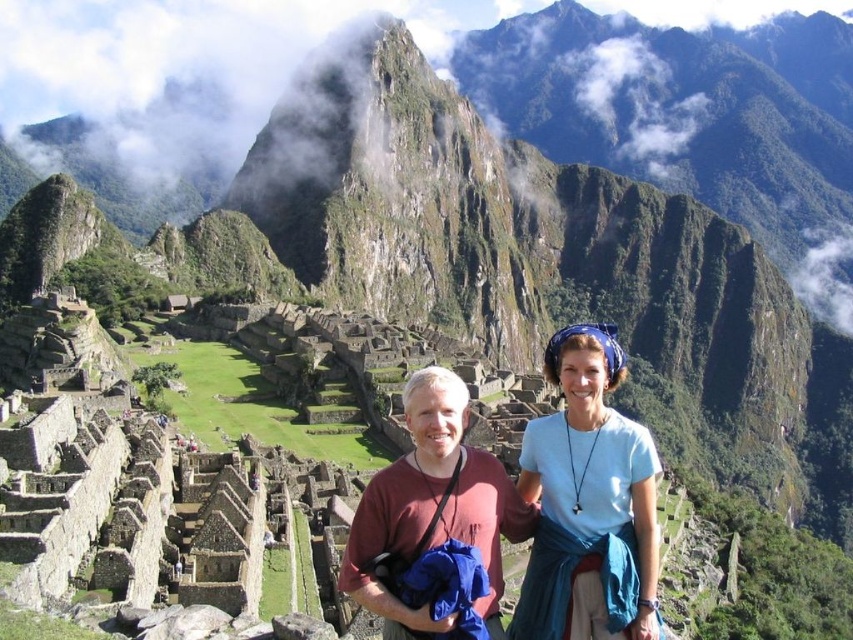
You are a tour guide at Machu Picchu and want to point out the exact location of the matte red shirt at center to your visitors. Using the coordinate system where the bottom left corner of the image is the origin, can you confirm if the point at (585, 502) is the correct coordinate for the matte red shirt at center?

Yes, the point at (585, 502) marks the location of the matte red shirt at center.

You are a photographer trying to capture the perfect shot of the matte red shirt at center and the blue fabric headscarf at upper right. Based on their positions, which object should you focus on first if you want to ensure both are in the frame without moving the camera?

The matte red shirt at center is not as tall as the blue fabric headscarf at upper right, so you should focus on the blue fabric headscarf at upper right first to ensure it stays within the frame.

You are a photographer planning to take a photo of the matte red shirt at center. What are the coordinates where you should focus your camera?

The coordinates to focus on are point (x=585, y=502).